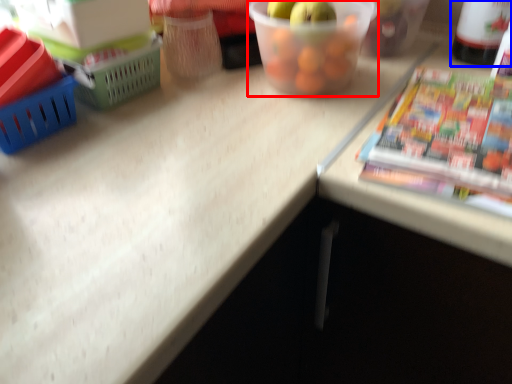
Question: Which of the following is the closest to the observer, glass bowl (highlighted by a red box) or bottle (highlighted by a blue box)?

Choices:
 (A) glass bowl
 (B) bottle

Answer: (A)